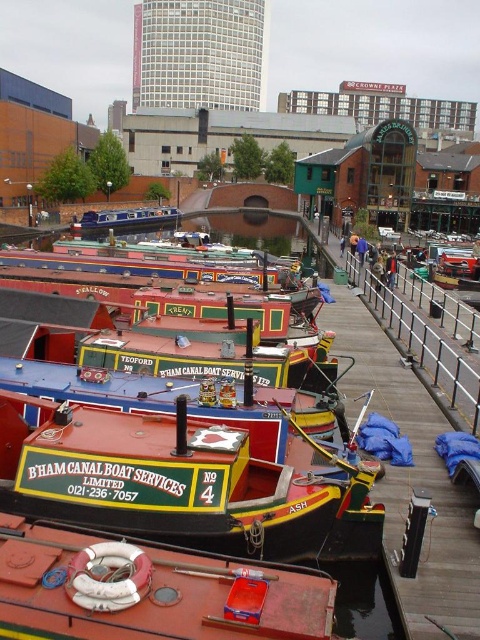
Which is in front, point (144, 541) or point (103, 218)?

Positioned in front is point (144, 541).

Is rustic wood boat at lower center closer to camera compared to matte blue boat at center?

Yes, rustic wood boat at lower center is closer to the viewer.

Between point (132, 588) and point (108, 220), which one is positioned in front?

Positioned in front is point (132, 588).

Locate an element on the screen. This screenshot has height=640, width=480. rustic wood boat at lower center is located at coordinates (147, 589).